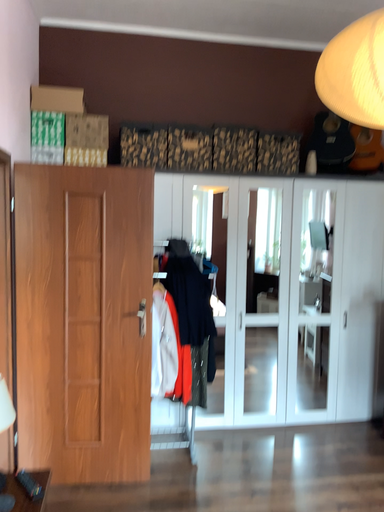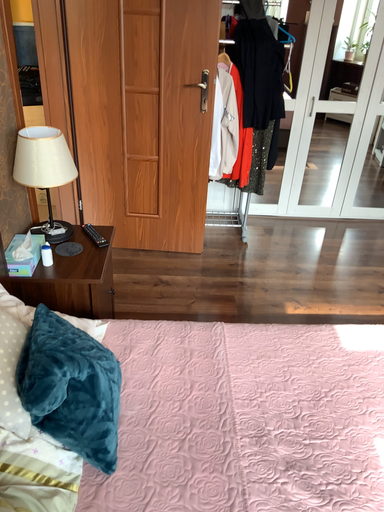
Question: Which way did the camera rotate in the video?

Choices:
 (A) rotated downward
 (B) rotated upward

Answer: (A)